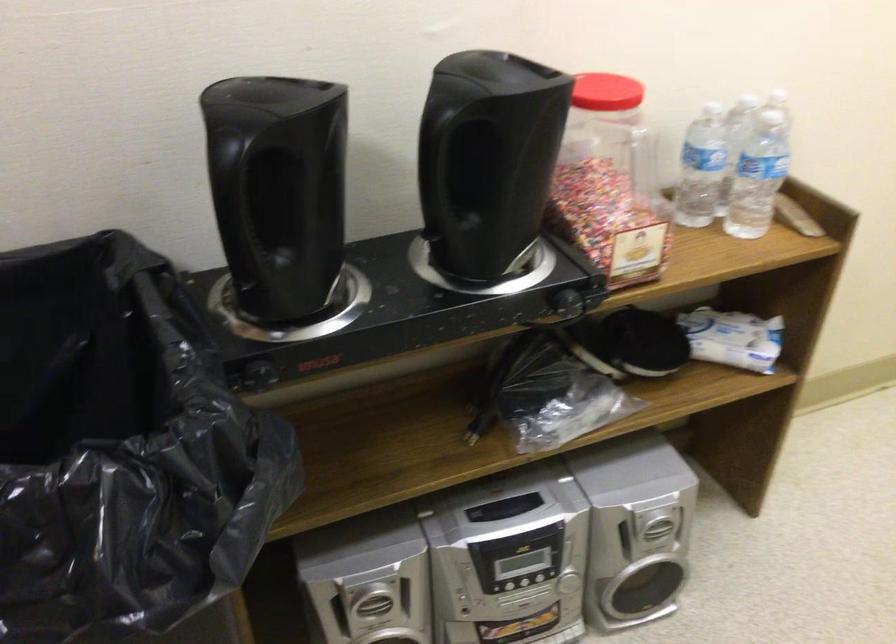
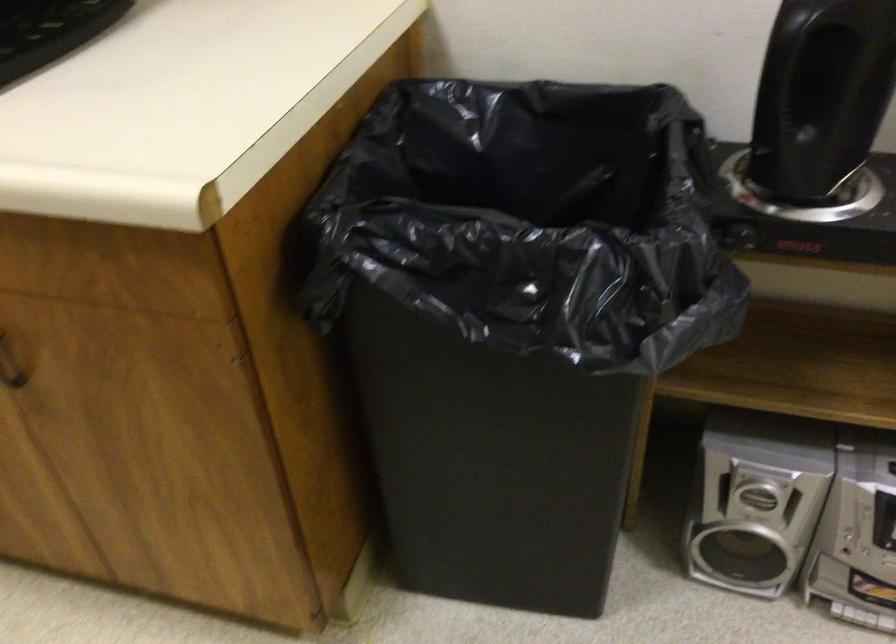
Question: The camera is either moving clockwise (left) or counter-clockwise (right) around the object. The first image is from the beginning of the video and the second image is from the end. Is the camera moving left or right when shooting the video?

Choices:
 (A) Left
 (B) Right

Answer: (B)